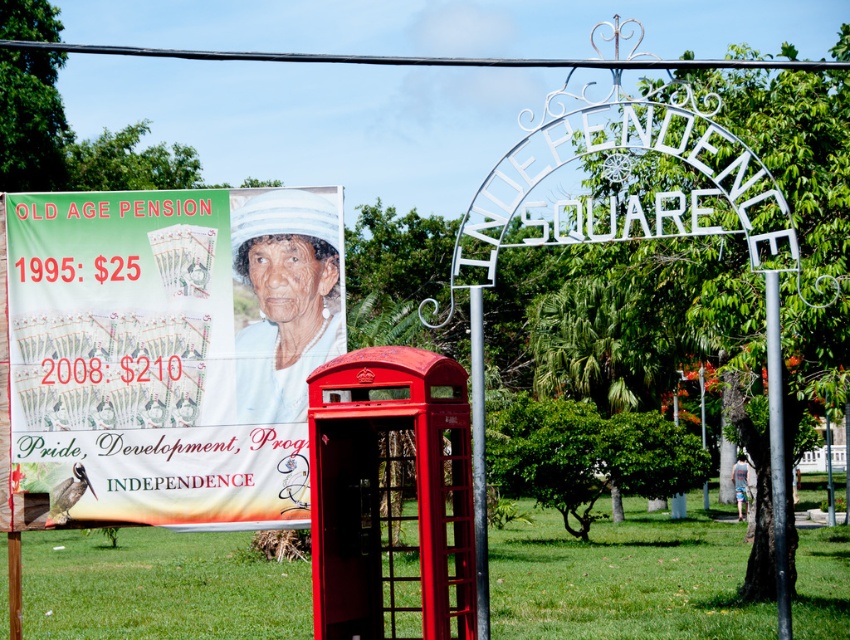
Question: Which point is closer to the camera?

Choices:
 (A) 479,305
 (B) 224,353
 (C) 320,612

Answer: (C)

Question: Does shiny red phone box at center have a lesser width compared to silver metallic pole at center?

Choices:
 (A) yes
 (B) no

Answer: (B)

Question: Is black metallic pole at center to the left of silver metallic pole at center from the viewer's perspective?

Choices:
 (A) no
 (B) yes

Answer: (A)

Question: Which point appears closest to the camera in this image?

Choices:
 (A) (477, 429)
 (B) (775, 513)

Answer: (A)

Question: Among these objects, which one is farthest from the camera?

Choices:
 (A) silver metallic pole at center
 (B) shiny red phone box at center
 (C) black metallic pole at center

Answer: (C)

Question: Is matte plastic poster at upper left above shiny red phone box at center?

Choices:
 (A) yes
 (B) no

Answer: (A)